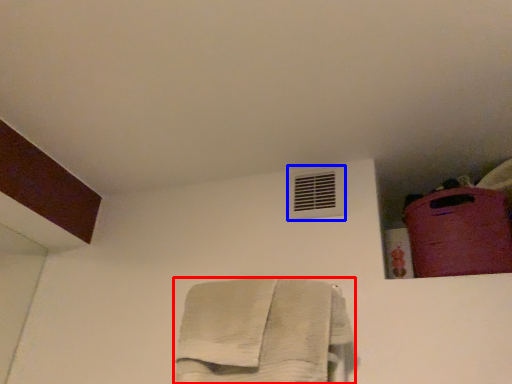
Question: Which point is closer to the camera, towel (highlighted by a red box) or air conditioning (highlighted by a blue box)?

Choices:
 (A) towel
 (B) air conditioning

Answer: (A)